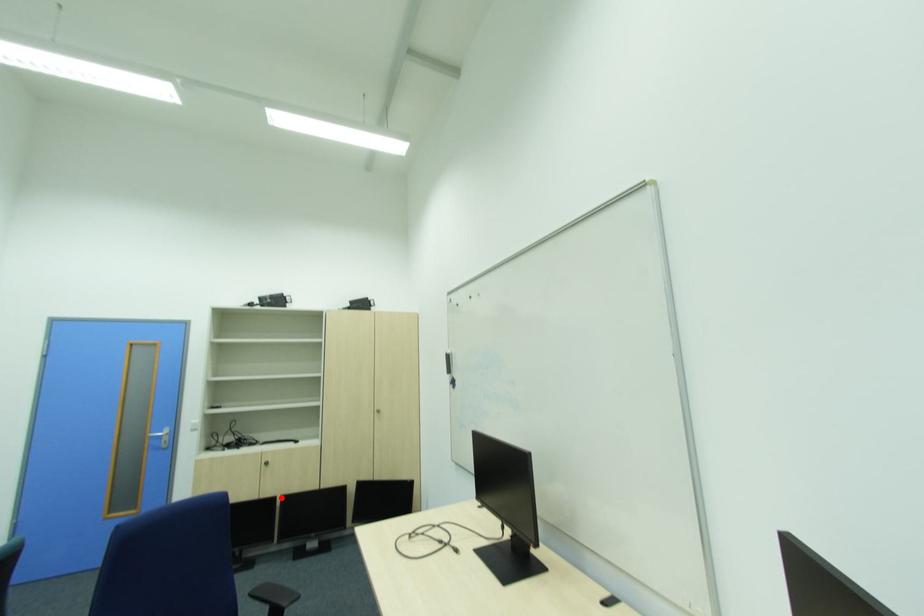
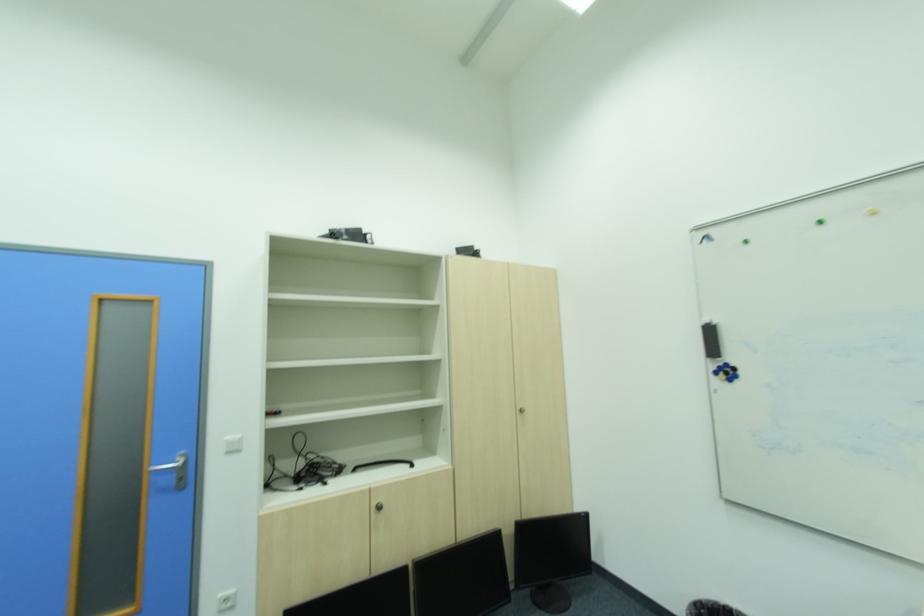
Find the pixel in the second image that matches the highlighted location in the first image.

(411, 570)